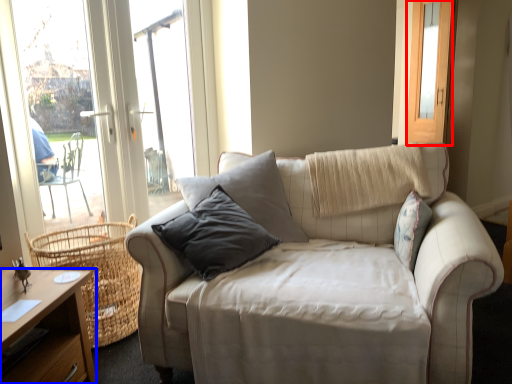
Question: Which point is closer to the camera, screen door (highlighted by a red box) or desk (highlighted by a blue box)?

Choices:
 (A) screen door
 (B) desk

Answer: (B)